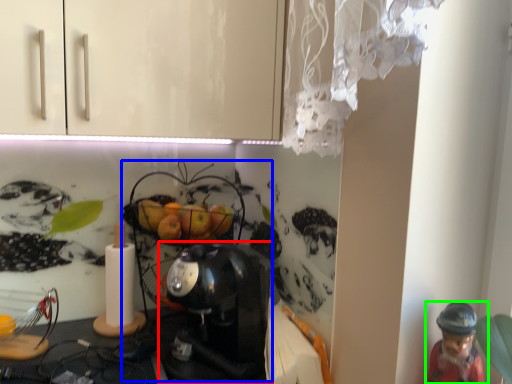
Question: Which is nearer to the coffee maker (highlighted by a red box)? toy (highlighted by a blue box) or person (highlighted by a green box).

Choices:
 (A) toy
 (B) person

Answer: (A)